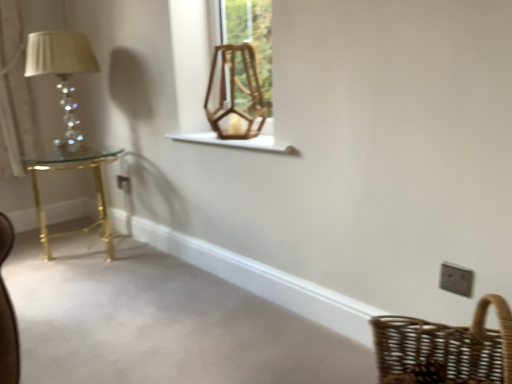
Question: Should I look upward or downward to see white plastic/light switch at lower right?

Choices:
 (A) down
 (B) up

Answer: (A)

Question: Is white wooden window sill at center shorter than wooden swivel chair at upper center?

Choices:
 (A) no
 (B) yes

Answer: (B)

Question: From a real-world perspective, is white wooden window sill at center physically above wooden swivel chair at upper center?

Choices:
 (A) yes
 (B) no

Answer: (B)

Question: Is white wooden window sill at center facing towards wooden swivel chair at upper center?

Choices:
 (A) yes
 (B) no

Answer: (B)

Question: Is white wooden window sill at center next to wooden swivel chair at upper center and touching it?

Choices:
 (A) yes
 (B) no

Answer: (B)

Question: Is white wooden window sill at center facing away from wooden swivel chair at upper center?

Choices:
 (A) yes
 (B) no

Answer: (B)

Question: Is white wooden window sill at center not inside wooden swivel chair at upper center?

Choices:
 (A) yes
 (B) no

Answer: (A)

Question: Is wooden swivel chair at upper center behind white wooden window sill at center?

Choices:
 (A) yes
 (B) no

Answer: (A)

Question: From the image's perspective, would you say wooden swivel chair at upper center is shown under white wooden window sill at center?

Choices:
 (A) no
 (B) yes

Answer: (A)

Question: Can you confirm if wooden swivel chair at upper center is positioned to the left of white wooden window sill at center?

Choices:
 (A) yes
 (B) no

Answer: (A)

Question: From a real-world perspective, is wooden swivel chair at upper center over white wooden window sill at center?

Choices:
 (A) no
 (B) yes

Answer: (B)

Question: Is wooden swivel chair at upper center oriented away from white wooden window sill at center?

Choices:
 (A) no
 (B) yes

Answer: (A)

Question: Does wooden swivel chair at upper center turn towards white wooden window sill at center?

Choices:
 (A) yes
 (B) no

Answer: (B)

Question: Are white plastic/light switch at lower right and gold metallic table at left far apart?

Choices:
 (A) no
 (B) yes

Answer: (B)